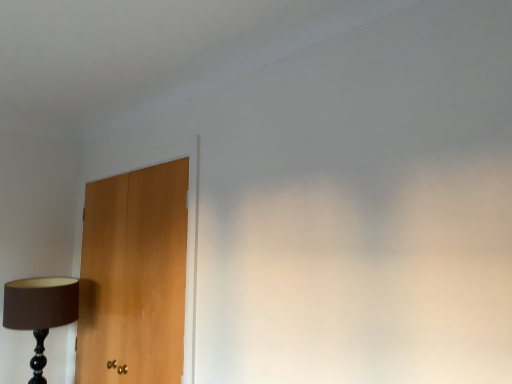
Question: From the image's perspective, is matte black lamp at left located above or below light brown wood door at left?

Choices:
 (A) above
 (B) below

Answer: (B)

Question: In terms of height, does matte black lamp at left look taller or shorter compared to light brown wood door at left?

Choices:
 (A) short
 (B) tall

Answer: (A)

Question: Considering the positions of point (77, 304) and point (172, 321), is point (77, 304) closer or farther from the camera than point (172, 321)?

Choices:
 (A) farther
 (B) closer

Answer: (A)

Question: Is light brown wood door at left in front of or behind matte black lamp at left in the image?

Choices:
 (A) behind
 (B) front

Answer: (B)

Question: Based on their positions, is light brown wood door at left located to the left or right of matte black lamp at left?

Choices:
 (A) right
 (B) left

Answer: (A)

Question: Is light brown wood door at left wider or thinner than matte black lamp at left?

Choices:
 (A) wide
 (B) thin

Answer: (B)

Question: From their relative heights in the image, would you say light brown wood door at left is taller or shorter than matte black lamp at left?

Choices:
 (A) tall
 (B) short

Answer: (A)